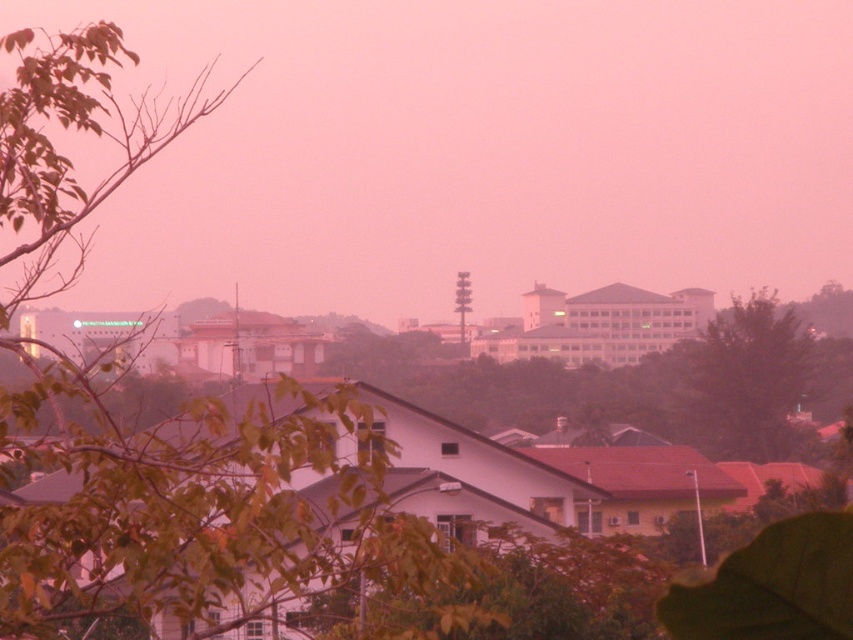
Question: Which point is farther from the camera taking this photo?

Choices:
 (A) (49, 262)
 (B) (714, 410)

Answer: (B)

Question: Where is green leafy tree at upper left located in relation to dark green leafy tree at right in the image?

Choices:
 (A) below
 (B) above

Answer: (B)

Question: Does green leafy tree at upper left have a greater width compared to dark green leafy tree at right?

Choices:
 (A) yes
 (B) no

Answer: (A)

Question: Which object appears farthest from the camera in this image?

Choices:
 (A) dark green leafy tree at right
 (B) green leafy tree at upper left

Answer: (A)

Question: Does green leafy tree at upper left appear over dark green leafy tree at right?

Choices:
 (A) no
 (B) yes

Answer: (B)